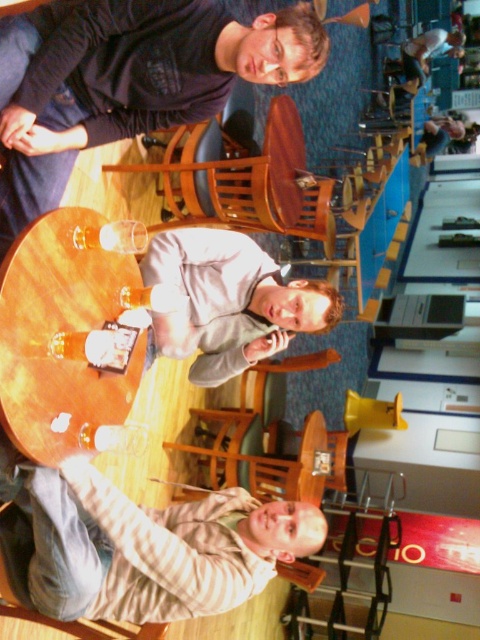
You are trying to decide whether to place a large pizza box on the wooden table at center. The pizza box is as wide as the matte black hoodie at upper center. Will it fit on the table?

The matte black hoodie at upper center is wider than the wooden table at center, so the pizza box, being as wide as the hoodie, would not fit on the table.

You are a delivery person who needs to place a small package between the matte black hoodie at upper center and the nearest edge of the table. Is there enough space for the package?

The matte black hoodie at upper center is 1.97 meters away from the nearest edge of the table, so there is sufficient space to place the small package between them.

You are standing at the entrance of the pub and want to locate two specific points in the image. The first point is at coordinates point [118,61] and the second is at point [87,253]. Which point is closer to you?

Point [118,61] is in front of point [87,253], so it is closer to you.